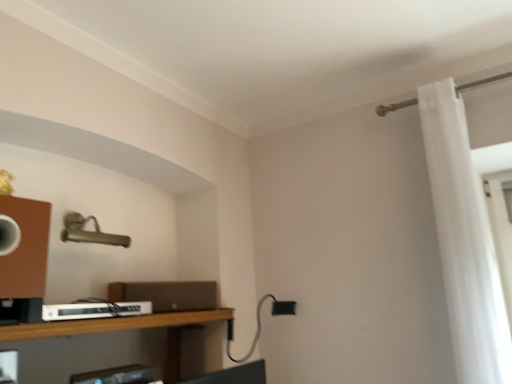
Describe the element at coordinates (95, 310) in the screenshot. I see `white plastic cable box at lower left` at that location.

Find the location of `white plastic cable box at lower left`. white plastic cable box at lower left is located at coordinates (95, 310).

Is wooden shelf at lower left taller than white sheer curtain at right?

Incorrect, the height of wooden shelf at lower left is not larger of that of white sheer curtain at right.

Is wooden shelf at lower left facing towards white sheer curtain at right?

No, wooden shelf at lower left is not oriented towards white sheer curtain at right.

Is wooden shelf at lower left wider or thinner than white sheer curtain at right?

wooden shelf at lower left is wider than white sheer curtain at right.

Which is in front, point (74, 330) or point (449, 94)?

The point (74, 330) is closer.

Considering the relative positions of white sheer curtain at right and white plastic cable box at lower left in the image provided, is white sheer curtain at right in front of white plastic cable box at lower left?

That is False.

Is white sheer curtain at right thinner than white plastic cable box at lower left?

Yes, white sheer curtain at right is thinner than white plastic cable box at lower left.

Measure the distance from white sheer curtain at right to white plastic cable box at lower left.

white sheer curtain at right and white plastic cable box at lower left are 4.41 feet apart.

Choose the correct answer: Is white sheer curtain at right inside white plastic cable box at lower left or outside it?

white sheer curtain at right is spatially situated outside white plastic cable box at lower left.

Is white plastic cable box at lower left a part of wooden shelf at lower left?

No, wooden shelf at lower left does not contain white plastic cable box at lower left.

Considering the points (129, 321) and (128, 311), which point is behind, point (129, 321) or point (128, 311)?

The point (128, 311) is farther from the camera.

From a real-world perspective, is wooden shelf at lower left physically located above or below white plastic cable box at lower left?

wooden shelf at lower left is situated lower than white plastic cable box at lower left in the real world.

Is white plastic cable box at lower left at the back of wooden shelf at lower left?

No, wooden shelf at lower left is not facing away from white plastic cable box at lower left.

Does white sheer curtain at right have a smaller size compared to wooden shelf at lower left?

No, white sheer curtain at right is not smaller than wooden shelf at lower left.

Between white sheer curtain at right and wooden shelf at lower left, which one is positioned behind?

white sheer curtain at right.

Does white sheer curtain at right have a lesser height compared to wooden shelf at lower left?

No, white sheer curtain at right is not shorter than wooden shelf at lower left.

Would you say white plastic cable box at lower left contains white sheer curtain at right?

No.

Where is `shower curtain on the right of white plastic cable box at lower left`? shower curtain on the right of white plastic cable box at lower left is located at coordinates (464, 240).

Does white plastic cable box at lower left have a lesser height compared to white sheer curtain at right?

Yes, white plastic cable box at lower left is shorter than white sheer curtain at right.

I want to click on equipment behind the wooden shelf at lower left, so click(x=95, y=310).

Based on the photo, are white plastic cable box at lower left and wooden shelf at lower left beside each other?

There is a gap between white plastic cable box at lower left and wooden shelf at lower left.

From the image's perspective, which is above, white plastic cable box at lower left or wooden shelf at lower left?

From the image's view, white plastic cable box at lower left is above.

The width and height of the screenshot is (512, 384). I want to click on shower curtain that appears above the wooden shelf at lower left (from the image's perspective), so click(x=464, y=240).

Find the location of `equipment located underneath the white sheer curtain at right (from a real-world perspective)`. equipment located underneath the white sheer curtain at right (from a real-world perspective) is located at coordinates (95, 310).

Based on their spatial positions, is white plastic cable box at lower left or white sheer curtain at right further from wooden shelf at lower left?

Among the two, white sheer curtain at right is located further to wooden shelf at lower left.

Estimate the real-world distances between objects in this image. Which object is closer to white sheer curtain at right, wooden shelf at lower left or white plastic cable box at lower left?

wooden shelf at lower left.

Which object lies nearer to the anchor point white plastic cable box at lower left, wooden shelf at lower left or white sheer curtain at right?

wooden shelf at lower left lies closer to white plastic cable box at lower left than the other object.

From the image, which object appears to be farther from white sheer curtain at right, white plastic cable box at lower left or wooden shelf at lower left?

white plastic cable box at lower left lies further to white sheer curtain at right than the other object.

Considering their positions, is white sheer curtain at right positioned closer to white plastic cable box at lower left than wooden shelf at lower left?

Among the two, wooden shelf at lower left is located nearer to white plastic cable box at lower left.

From the image, which object appears to be farther from wooden shelf at lower left, white sheer curtain at right or white plastic cable box at lower left?

white sheer curtain at right is further to wooden shelf at lower left.

Locate an element on the screen. shelf between white plastic cable box at lower left and white sheer curtain at right from left to right is located at coordinates point(112,324).